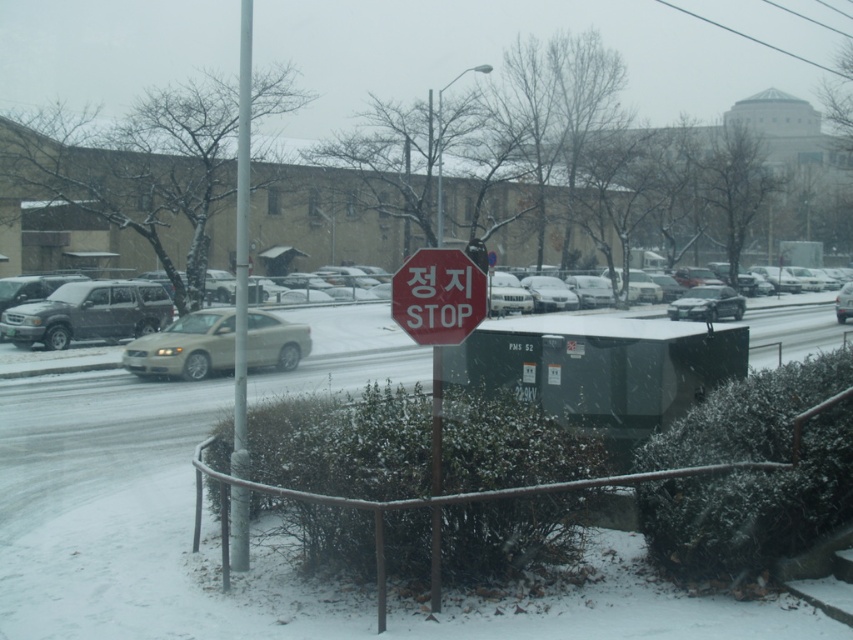
You are a pedestrian standing at the edge of the snow covered street. You see the red matte stop sign at center and the white glossy car at center. Which object is closer to your left side?

The red matte stop sign at center is to the left of the white glossy car at center, so it is closer to your left side.

You are a delivery person trying to park your white glossy car at center in a spot near the red matte stop sign at center. The parking spot requires the car to be no taller than the stop sign. Can you park there?

The red matte stop sign at center has a lesser height compared to the white glossy car at center. Since the car is taller than the stop sign, you cannot park there as it exceeds the height requirement.

You are a delivery person trying to navigate through the snowy street. You see a satin beige sedan at center and a white glossy car at center. How far apart are these two cars from each other?

The satin beige sedan at center is 21.77 meters away from the white glossy car at center.